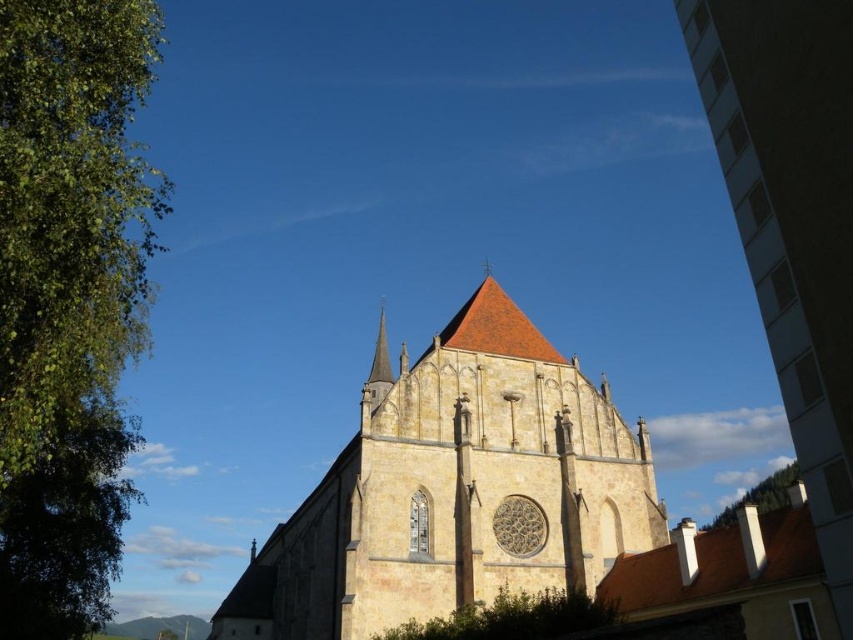
You are standing in front of the historic stone church and want to determine the relative positions of two points marked on the image. Which point is closer to you, point (450,428) or point (54,435)?

Point (450,428) is further to the viewer than point (54,435), so the point closer to you is point (54,435).

You are standing in front of the historic stone church and notice two green leafy trees in the scene. Which tree, the green leafy tree at left or the green leafy tree at upper left, has a greater height?

The green leafy tree at left is taller than the green leafy tree at upper left.